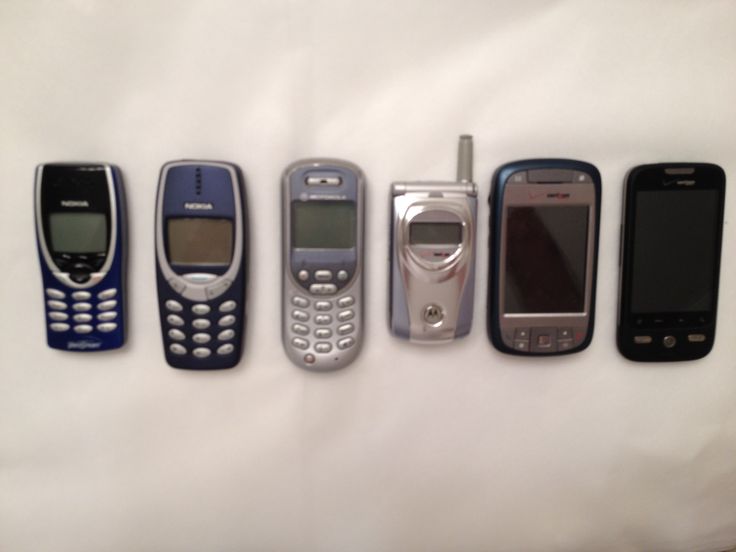
Where is `phone`? The width and height of the screenshot is (736, 552). phone is located at coordinates (661, 251), (541, 272), (439, 301), (308, 331), (194, 337), (74, 326).